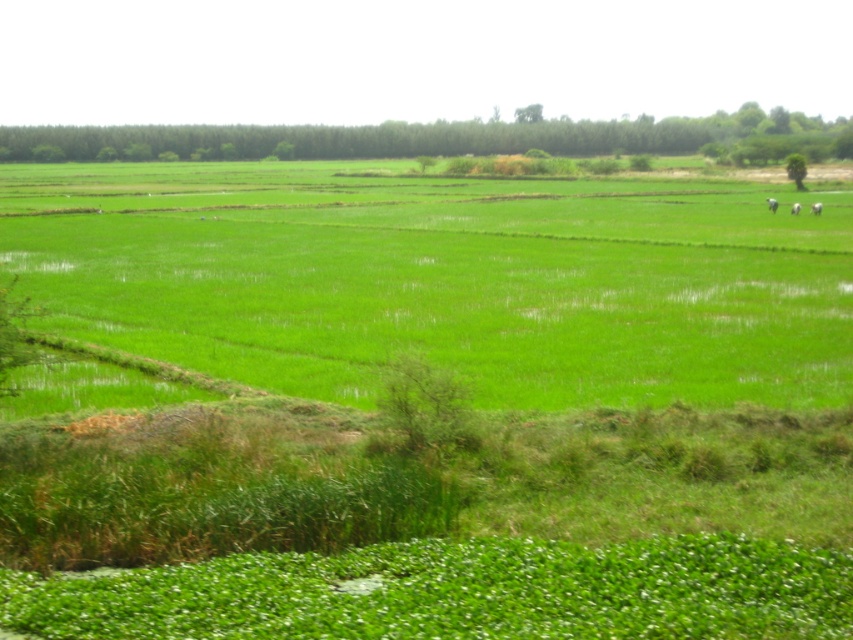
Question: Is green grass at center below white fluffy sheep at upper right?

Choices:
 (A) yes
 (B) no

Answer: (B)

Question: Is green grass at center smaller than white fluffy sheep at upper right?

Choices:
 (A) no
 (B) yes

Answer: (A)

Question: Which of the following is the closest to the observer?

Choices:
 (A) white fluffy sheep at upper right
 (B) green grass at center
 (C) white woolen sheep at right
 (D) white fluffy cow at upper right

Answer: (B)

Question: Which point is closer to the camera taking this photo?

Choices:
 (A) (799, 204)
 (B) (820, 205)
 (C) (776, 204)

Answer: (A)

Question: Where is green grass at center located in relation to white fluffy sheep at upper right in the image?

Choices:
 (A) below
 (B) above

Answer: (B)

Question: Which of these objects is positioned closest to the green grass at center?

Choices:
 (A) white fluffy sheep at upper right
 (B) white fluffy cow at upper right
 (C) white woolen sheep at right

Answer: (C)